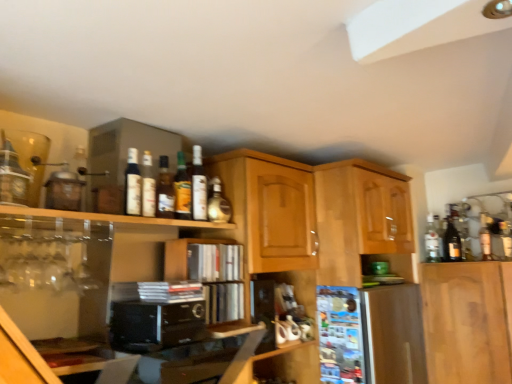
Question: Is matte glass bottle at upper center, which ranks as the 4th bottle in right-to-left order, closer to camera compared to wooden cabinet at center, the first cabinetry positioned from the left?

Choices:
 (A) yes
 (B) no

Answer: (B)

Question: Considering the relative sizes of matte glass bottle at upper center, which ranks as the 4th bottle in right-to-left order, and wooden cabinet at center, the first cabinetry positioned from the left, in the image provided, is matte glass bottle at upper center, which ranks as the 4th bottle in right-to-left order, wider than wooden cabinet at center, the first cabinetry positioned from the left,?

Choices:
 (A) no
 (B) yes

Answer: (A)

Question: Is matte glass bottle at upper center, placed as the 4th bottle when sorted from left to right, facing away from wooden cabinet at center, arranged as the third cabinetry when viewed from the right?

Choices:
 (A) yes
 (B) no

Answer: (B)

Question: Is matte glass bottle at upper center, which ranks as the 4th bottle in right-to-left order, at the right side of wooden cabinet at center, the first cabinetry positioned from the left?

Choices:
 (A) no
 (B) yes

Answer: (A)

Question: Does matte glass bottle at upper center, marked as the 4th bottle in a back-to-front arrangement, have a lesser width compared to wooden cabinet at center, arranged as the third cabinetry when viewed from the right?

Choices:
 (A) yes
 (B) no

Answer: (A)

Question: From the image's perspective, is matte glass bottle at upper center, which appears as the 4th bottle when viewed from the front, under wooden cabinet at center, arranged as the third cabinetry when viewed from the right?

Choices:
 (A) no
 (B) yes

Answer: (A)

Question: From the image's perspective, is glossy wood cabinet at upper right, the first cabinetry viewed from the right, beneath wooden cabinet at center, arranged as the third cabinetry when viewed from the right?

Choices:
 (A) no
 (B) yes

Answer: (A)

Question: Is the depth of glossy wood cabinet at upper right, positioned as the 3th cabinetry in left-to-right order, less than that of wooden cabinet at center, arranged as the third cabinetry when viewed from the right?

Choices:
 (A) yes
 (B) no

Answer: (B)

Question: Can you confirm if glossy wood cabinet at upper right, the first cabinetry viewed from the right, is bigger than wooden cabinet at center, the first cabinetry positioned from the left?

Choices:
 (A) yes
 (B) no

Answer: (A)

Question: Is glossy wood cabinet at upper right, positioned as the 3th cabinetry in left-to-right order, thinner than wooden cabinet at center, arranged as the third cabinetry when viewed from the right?

Choices:
 (A) no
 (B) yes

Answer: (A)

Question: Can you confirm if glossy wood cabinet at upper right, positioned as the 3th cabinetry in left-to-right order, is wider than wooden cabinet at center, the first cabinetry positioned from the left?

Choices:
 (A) no
 (B) yes

Answer: (B)

Question: From the image's perspective, is glossy wood cabinet at upper right, positioned as the 3th cabinetry in left-to-right order, on wooden cabinet at center, arranged as the third cabinetry when viewed from the right?

Choices:
 (A) no
 (B) yes

Answer: (B)

Question: Is clear glass bottle at right, arranged as the seventh bottle when viewed from the left, at the right side of black matte microwave at center?

Choices:
 (A) no
 (B) yes

Answer: (B)